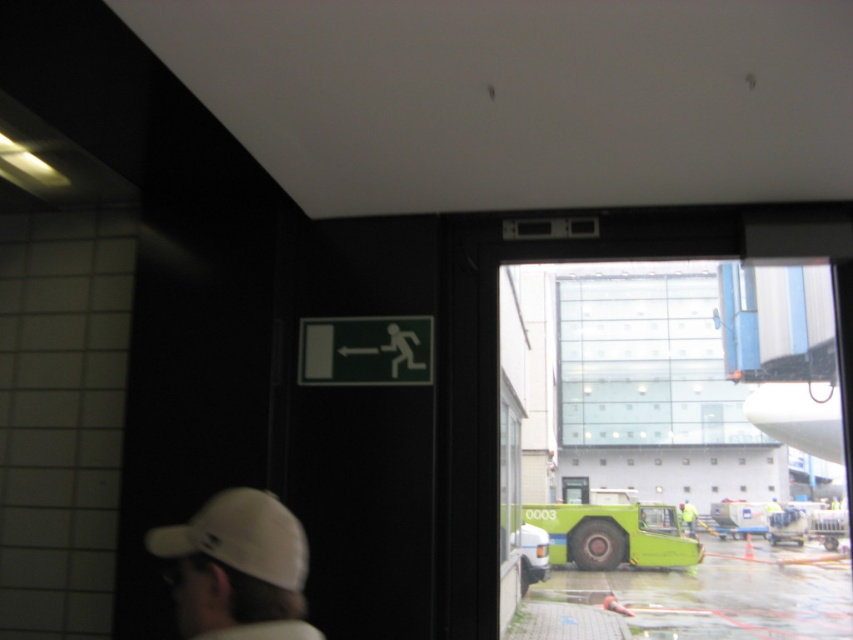
Question: Is transparent glass window at center to the left of green rubber tarmac at lower center from the viewer's perspective?

Choices:
 (A) yes
 (B) no

Answer: (B)

Question: Which object is closer to the camera taking this photo?

Choices:
 (A) white matte baseball cap at lower left
 (B) green rubber tarmac at lower center

Answer: (A)

Question: Among these points, which one is farthest from the camera?

Choices:
 (A) (305, 545)
 (B) (666, 352)
 (C) (315, 321)

Answer: (B)

Question: Is transparent glass window at center closer to the viewer compared to green matte exit sign at upper center?

Choices:
 (A) no
 (B) yes

Answer: (A)

Question: Which object is the farthest from the green matte exit sign at upper center?

Choices:
 (A) transparent glass window at center
 (B) green rubber tarmac at lower center
 (C) white matte baseball cap at lower left

Answer: (A)

Question: Can you confirm if green matte exit sign at upper center is wider than yellow reflective vest at center?

Choices:
 (A) yes
 (B) no

Answer: (B)